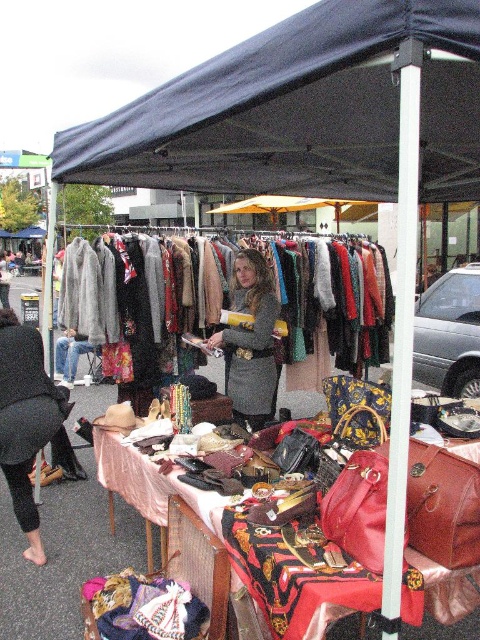
Measure the distance between black knit hat at lower left and gray woolen coat at center.

The distance of black knit hat at lower left from gray woolen coat at center is 4.28 feet.

Is black knit hat at lower left smaller than gray woolen coat at center?

Yes.

Does point (31, 531) come in front of point (227, 371)?

Yes, point (31, 531) is in front of point (227, 371).

Find the location of `black knit hat at lower left`. black knit hat at lower left is located at coordinates (24, 412).

Does point (343, 291) lie behind point (23, 525)?

That is True.

Is velvet floral dress at center to the left of black knit hat at lower left from the viewer's perspective?

Incorrect, velvet floral dress at center is not on the left side of black knit hat at lower left.

Between point (110, 237) and point (48, 378), which one is positioned in front?

Point (48, 378)

Find the location of a particular element. This screenshot has width=480, height=640. velvet floral dress at center is located at coordinates (334, 298).

Which is above, dark blue fabric canopy at upper center or gray woolen coat at center?

dark blue fabric canopy at upper center is above.

Measure the distance between dark blue fabric canopy at upper center and camera.

The distance of dark blue fabric canopy at upper center from camera is 4.93 feet.

Locate an element on the screen. dark blue fabric canopy at upper center is located at coordinates (301, 109).